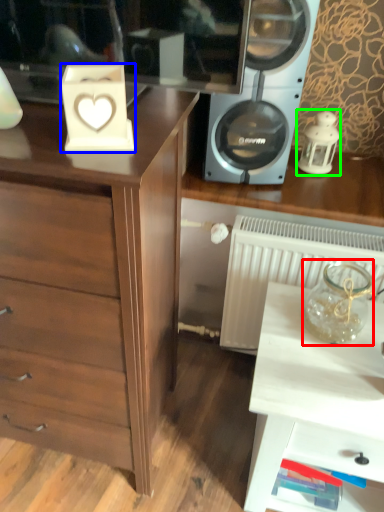
Question: Which object is the farthest from glass vase (highlighted by a red box)? Choose among these: appliance (highlighted by a blue box) or candle holder (highlighted by a green box).

Choices:
 (A) appliance
 (B) candle holder

Answer: (A)